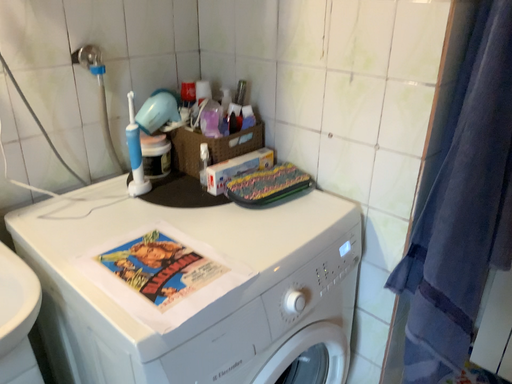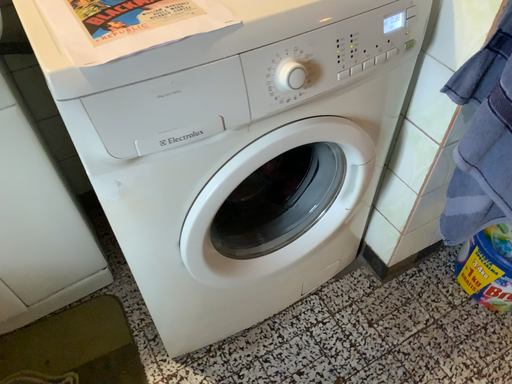
Question: Which way did the camera rotate in the video?

Choices:
 (A) rotated left
 (B) rotated right

Answer: (A)